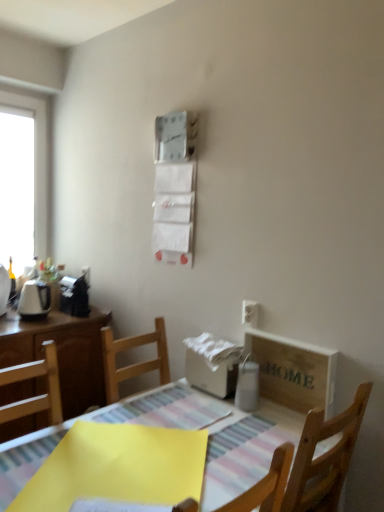
Question: Is white glossy window at left wider than wooden crate at lower right?

Choices:
 (A) no
 (B) yes

Answer: (B)

Question: Considering the relative sizes of white glossy window at left and wooden crate at lower right in the image provided, is white glossy window at left shorter than wooden crate at lower right?

Choices:
 (A) yes
 (B) no

Answer: (B)

Question: Can you confirm if white glossy window at left is positioned to the left of wooden crate at lower right?

Choices:
 (A) yes
 (B) no

Answer: (A)

Question: From a real-world perspective, is white glossy window at left beneath wooden crate at lower right?

Choices:
 (A) yes
 (B) no

Answer: (B)

Question: Could you tell me if white glossy window at left is turned towards wooden crate at lower right?

Choices:
 (A) no
 (B) yes

Answer: (B)

Question: Is white plastic electric outlet at upper right taller or shorter than white glossy window at left?

Choices:
 (A) short
 (B) tall

Answer: (A)

Question: In terms of width, does white plastic electric outlet at upper right look wider or thinner when compared to white glossy window at left?

Choices:
 (A) thin
 (B) wide

Answer: (A)

Question: Is white plastic electric outlet at upper right situated inside white glossy window at left or outside?

Choices:
 (A) outside
 (B) inside

Answer: (A)

Question: Would you say white plastic electric outlet at upper right is to the left or to the right of white glossy window at left in the picture?

Choices:
 (A) left
 (B) right

Answer: (B)

Question: In terms of width, does wooden table at center look wider or thinner when compared to white glossy window at left?

Choices:
 (A) wide
 (B) thin

Answer: (A)

Question: Based on their positions, is wooden table at center located to the left or right of white glossy window at left?

Choices:
 (A) left
 (B) right

Answer: (B)

Question: Is wooden table at center bigger or smaller than white glossy window at left?

Choices:
 (A) big
 (B) small

Answer: (A)

Question: In terms of height, does wooden table at center look taller or shorter compared to white glossy window at left?

Choices:
 (A) tall
 (B) short

Answer: (B)

Question: From the image's perspective, relative to wooden crate at lower right, is white glossy window at left above or below?

Choices:
 (A) below
 (B) above

Answer: (B)

Question: Considering the positions of white glossy window at left and wooden crate at lower right in the image, is white glossy window at left taller or shorter than wooden crate at lower right?

Choices:
 (A) short
 (B) tall

Answer: (B)